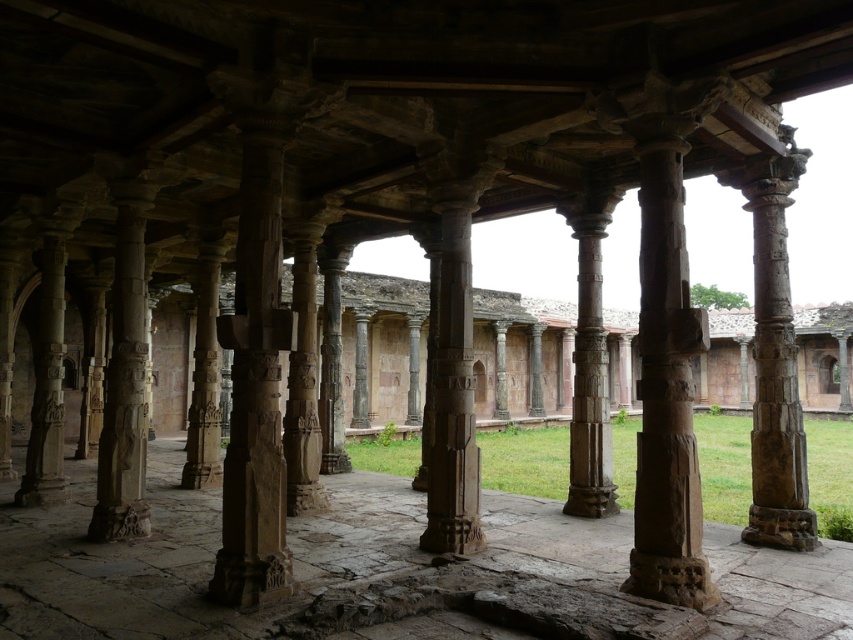
You are standing at the origin point of the coordinate system in the courtyard. You want to move towards the brown stone column at center. What are the coordinates you need to move to reach it?

The coordinates of the brown stone column at center are at point (254, 384), so you need to move to those coordinates to reach it.

You are an architect examining the ancient structure. You notice two columns at the center of the scene. The rustic stone column at center and the brown stone column at center. Which one is located higher up?

The rustic stone column at center is positioned over the brown stone column at center, so the rustic stone column at center is higher up.